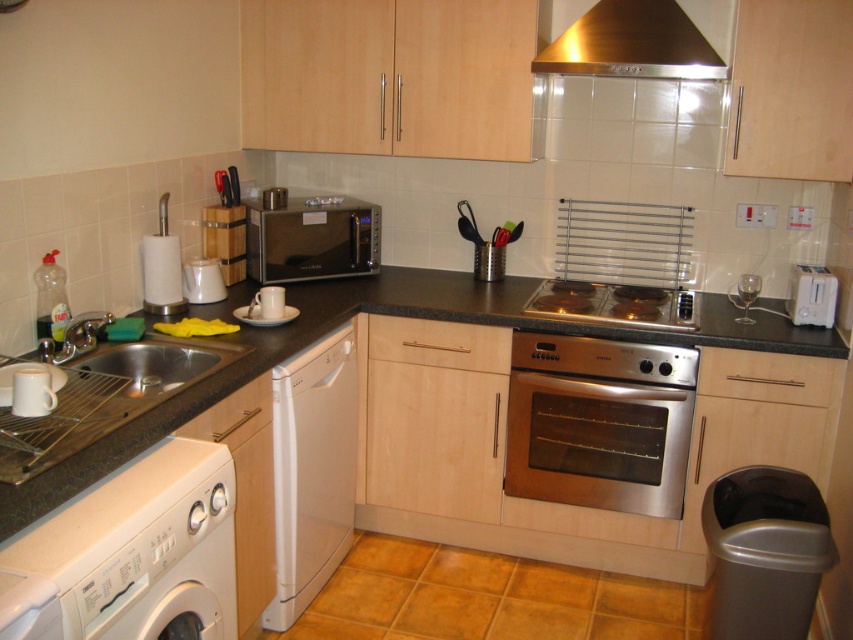
You are a delivery person who needs to place a new microwave that is 2.5 feet wide into this kitchen. The microwave must be placed between the white plastic washing machine at lower left and the white plastic toaster at upper right. Will there be enough space for the microwave?

The white plastic washing machine at lower left and white plastic toaster at upper right are 6.42 feet apart from each other. Since the microwave is 2.5 feet wide, there is sufficient space between them to accommodate it.

You are a chef preparing ingredients and need to place a cutting board on the black granite countertop at lower left. Where exactly should you place it?

The black granite countertop at lower left is located at point [378,314], so you should place the cutting board there.